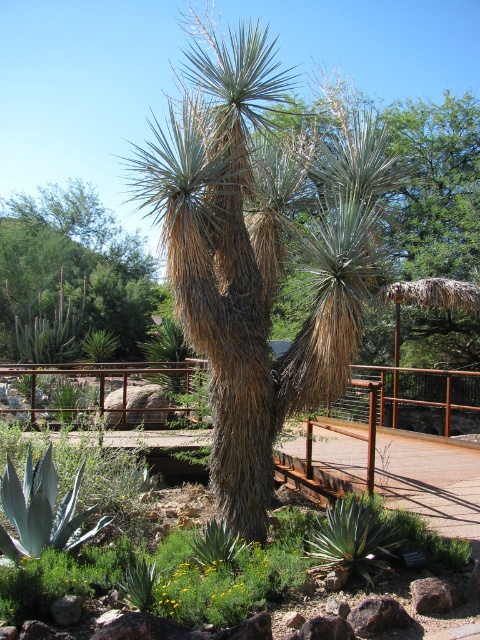
You are a gardener standing in the botanical garden scene. You need to water the green leafy tree at center and the gray rock at center. Which object should you water first if you want to reach the closer one first?

You should water the green leafy tree at center first because it is closer to you than the gray rock at center.

You are standing in the botanical garden and see a green leafy tree at center. There is a point marked at coordinates (74, 264). Is this point located on the green leafy tree at center?

Yes, the point (74, 264) is on the green leafy tree at center as stated in the objects description.